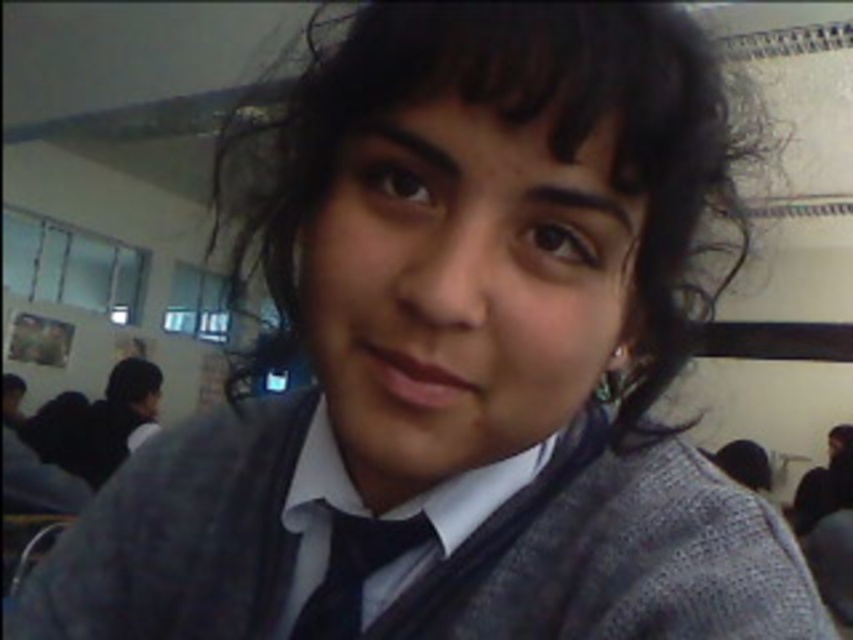
Does dark brown silky hair at center have a lesser height compared to black satin tie at center?

Incorrect, dark brown silky hair at center's height does not fall short of black satin tie at center's.

Can you confirm if dark brown silky hair at center is wider than black satin tie at center?

Yes.

Does point (558, 20) come closer to viewer compared to point (312, 630)?

Yes, it is in front of point (312, 630).

You are a GUI agent. You are given a task and a screenshot of the screen. Output one action in this format:
    pyautogui.click(x=<x>, y=<y>)
    Task: Click on the dark brown silky hair at center
    The width and height of the screenshot is (853, 640).
    Given the screenshot: What is the action you would take?
    [x=511, y=128]

Between matte gray sweater at center and black satin tie at center, which one is positioned higher?

matte gray sweater at center is above.

Does matte gray sweater at center appear on the left side of black satin tie at center?

Yes, matte gray sweater at center is to the left of black satin tie at center.

You are a GUI agent. You are given a task and a screenshot of the screen. Output one action in this format:
    pyautogui.click(x=<x>, y=<y>)
    Task: Click on the matte gray sweater at center
    
    Given the screenshot: What is the action you would take?
    pyautogui.click(x=618, y=557)

Is matte gray sweater at center below dark brown silky hair at center?

Yes.

Is point (196, 545) positioned after point (358, 76)?

Yes, it is.

The width and height of the screenshot is (853, 640). I want to click on matte gray sweater at center, so click(618, 557).